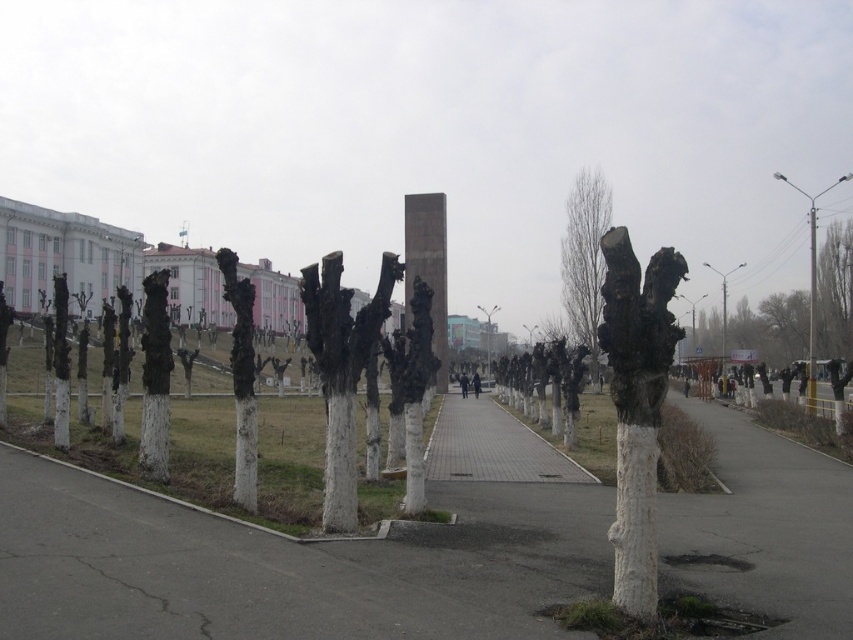
You are a city planner assessing the urban space. You notice the smooth white tree trunk at center and the metallic pole at right. Which object has a smaller diameter?

The smooth white tree trunk at center has a smaller diameter than the metallic pole at right.

You are a city planner who needs to install a new streetlight between the smooth bark tree at center and the smooth white tree trunk at center. The streetlight requires a minimum of 50 meters of space between the two trees to be placed safely. Based on the image, can the streetlight be installed between them?

The distance between the smooth bark tree at center and the smooth white tree trunk at center is 49.30 meters, which is less than the required 50 meters. Therefore, the streetlight cannot be safely installed between them.

You are a city planner assessing the urban space. You notice the white painted wood tree stump at right and the smooth white tree trunk at center. Which of these two objects takes up more space in the scene?

The smooth white tree trunk at center takes up more space than the white painted wood tree stump at right.